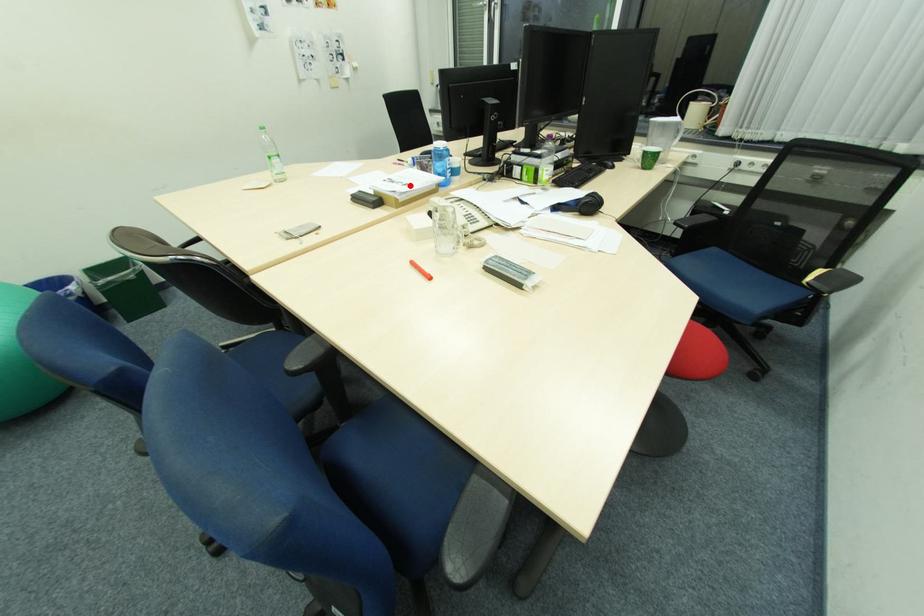
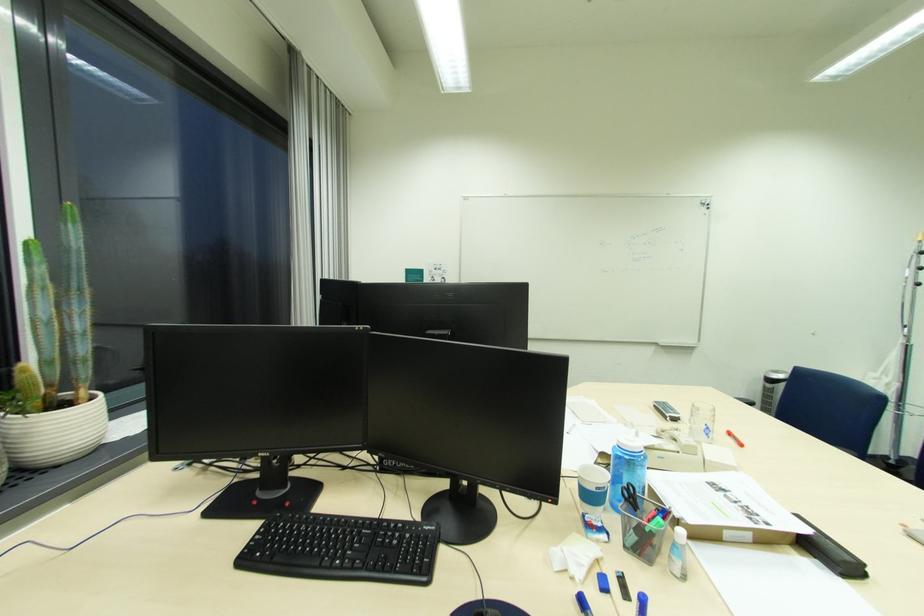
Find the pixel in the second image that matches the highlighted location in the first image.

(731, 491)